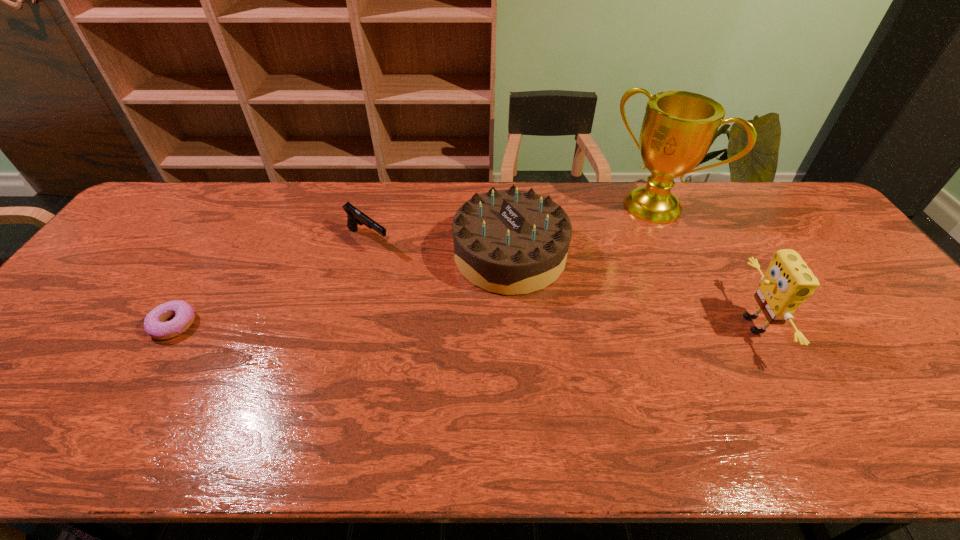
Image resolution: width=960 pixels, height=540 pixels. I want to click on vacant space positioned 0.050m on the face of the fourth shortest object, so click(x=716, y=325).

Where is `free space located on the face of the fourth shortest object`? The height and width of the screenshot is (540, 960). free space located on the face of the fourth shortest object is located at coordinates (641, 325).

The width and height of the screenshot is (960, 540). Find the location of `free location located on the front-facing side of the third object from left to right`. free location located on the front-facing side of the third object from left to right is located at coordinates (360, 374).

This screenshot has height=540, width=960. In order to click on free location located on the front-facing side of the third object from left to right in this screenshot , I will do `click(371, 366)`.

The width and height of the screenshot is (960, 540). Find the location of `vacant region located 0.090m on the front-facing side of the third object from left to right`. vacant region located 0.090m on the front-facing side of the third object from left to right is located at coordinates (448, 303).

Where is `vacant area situated 0.310m at the aiming end of the second shortest object`? vacant area situated 0.310m at the aiming end of the second shortest object is located at coordinates pyautogui.click(x=457, y=306).

The image size is (960, 540). Find the location of `free spot located at the aiming end of the second shortest object`. free spot located at the aiming end of the second shortest object is located at coordinates (424, 282).

Locate an element on the screen. Image resolution: width=960 pixels, height=540 pixels. blank space located 0.260m at the aiming end of the second shortest object is located at coordinates (444, 296).

Identify the location of vacant position located 0.380m on the shiny surface of the award. (567, 295).

At what (x,y) coordinates should I click in order to perform the action: click on vacant region located on the shiny surface of the award. Please return your answer as a coordinate pair (x, y). Looking at the image, I should click on (573, 289).